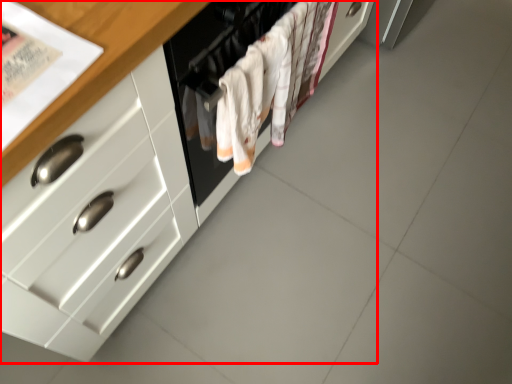
Question: Considering the relative positions of cabinetry (annotated by the red box) and oven in the image provided, where is cabinetry (annotated by the red box) located with respect to the staircase?

Choices:
 (A) right
 (B) left

Answer: (B)